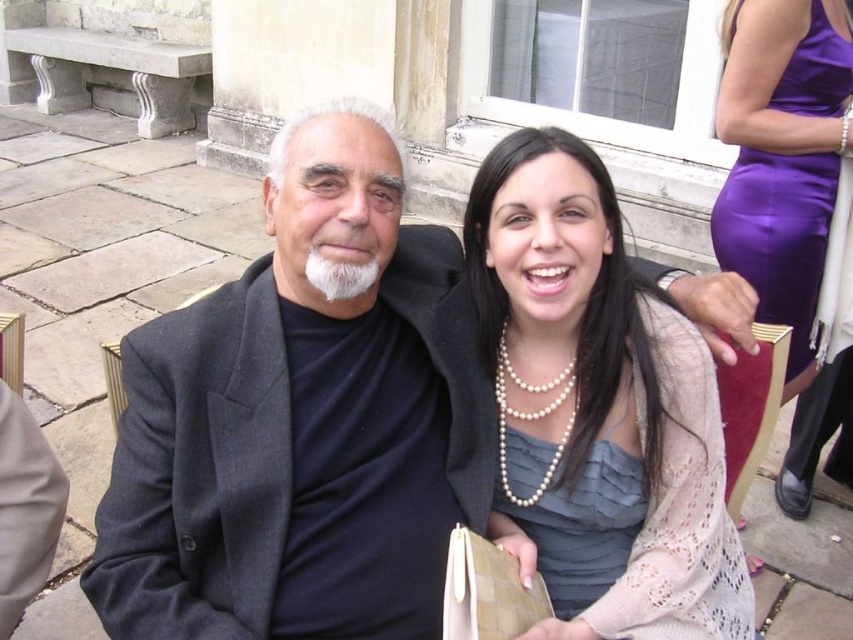
You are a photographer at a formal event. You want to take a photo of the purple satin dress at right and the gray satin dress at center. The minimum distance required for your camera to focus properly is 4 feet. Will both dresses be in focus if they are 4.17 feet apart?

The purple satin dress at right is 4.17 feet from the gray satin dress at center. Since the distance between them is greater than the 4 feet minimum requirement, both dresses will be in focus.

You are a photographer at a formal event and need to ensure that both the dark gray suit at center and the pearl necklace at center are visible in your portrait. Given their positions, which object should you focus on first to ensure proper framing?

The dark gray suit at center has a greater height compared to pearl necklace at center, so you should focus on the dark gray suit at center first to ensure proper framing as it occupies more vertical space.

You are an event planner trying to place a name tag on the dark gray suit at center. The coordinate system starts at the bottom left corner of the image. The name tag must be placed at the center of the suit. What are the coordinates where you should place the name tag?

The coordinates for placing the name tag on the dark gray suit at center are at point (305,420).